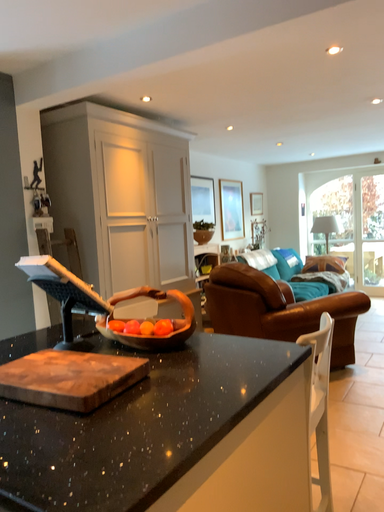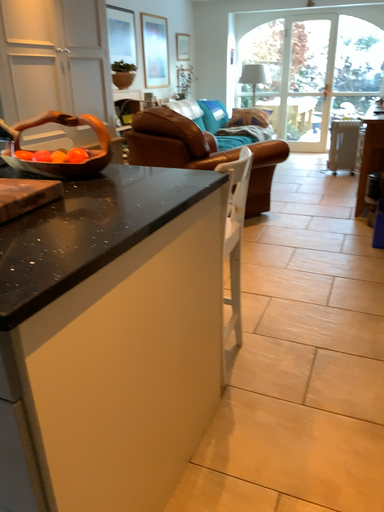
Question: How did the camera likely rotate when shooting the video?

Choices:
 (A) rotated left
 (B) rotated right

Answer: (B)